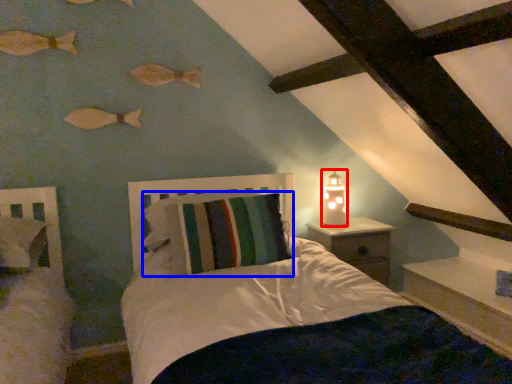
Question: Which of the following is the farthest to the observer, candle holder (highlighted by a red box) or pillow (highlighted by a blue box)?

Choices:
 (A) candle holder
 (B) pillow

Answer: (A)